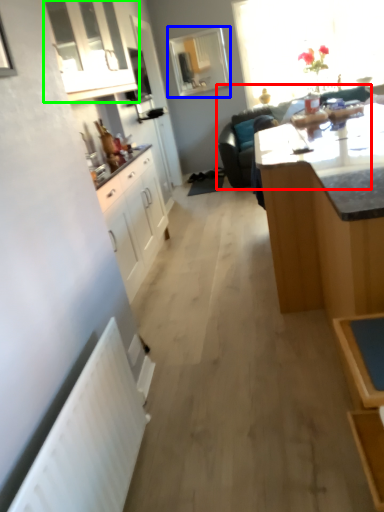
Question: Which object is the farthest from studio couch (highlighted by a red box)? Choose among these: window (highlighted by a blue box) or cabinetry (highlighted by a green box).

Choices:
 (A) window
 (B) cabinetry

Answer: (A)